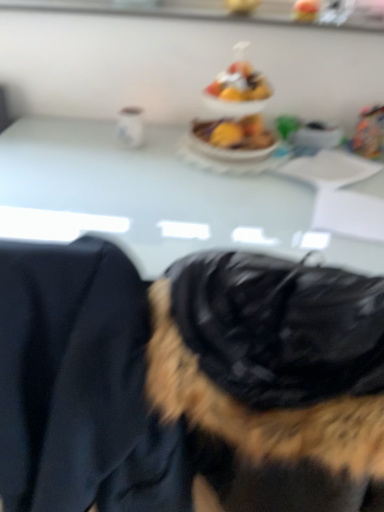
Question: Is white glossy table at center in front of black fur coat at center?

Choices:
 (A) no
 (B) yes

Answer: (A)

Question: From a real-world perspective, does white glossy table at center sit lower than black fur coat at center?

Choices:
 (A) no
 (B) yes

Answer: (B)

Question: Is white glossy table at center outside black fur coat at center?

Choices:
 (A) no
 (B) yes

Answer: (B)

Question: Does white glossy table at center come behind black fur coat at center?

Choices:
 (A) no
 (B) yes

Answer: (B)

Question: Is white glossy table at center wider than black fur coat at center?

Choices:
 (A) no
 (B) yes

Answer: (B)

Question: From their relative heights in the image, would you say shiny plastic fruit bowl at center is taller or shorter than white glossy table at center?

Choices:
 (A) short
 (B) tall

Answer: (A)

Question: In terms of size, does shiny plastic fruit bowl at center appear bigger or smaller than white glossy table at center?

Choices:
 (A) small
 (B) big

Answer: (A)

Question: From a real-world perspective, is shiny plastic fruit bowl at center physically located above or below white glossy table at center?

Choices:
 (A) above
 (B) below

Answer: (A)

Question: From the image's perspective, is shiny plastic fruit bowl at center positioned above or below white glossy table at center?

Choices:
 (A) above
 (B) below

Answer: (A)

Question: Based on their positions, is black fur coat at center located to the left or right of white glossy table at center?

Choices:
 (A) left
 (B) right

Answer: (B)

Question: Does point (225, 260) appear closer or farther from the camera than point (155, 223)?

Choices:
 (A) farther
 (B) closer

Answer: (B)

Question: Is black fur coat at center taller or shorter than white glossy table at center?

Choices:
 (A) tall
 (B) short

Answer: (A)

Question: From the image's perspective, relative to white glossy table at center, is black fur coat at center above or below?

Choices:
 (A) above
 (B) below

Answer: (B)

Question: Does point (0, 199) appear closer or farther from the camera than point (261, 76)?

Choices:
 (A) farther
 (B) closer

Answer: (B)

Question: From a real-world perspective, is white glossy table at center positioned above or below shiny plastic fruit bowl at center?

Choices:
 (A) above
 (B) below

Answer: (B)